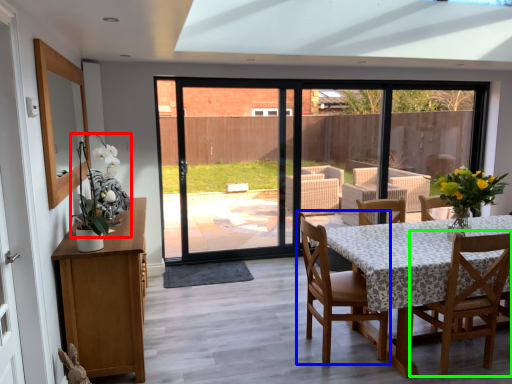
Question: Considering the real-world distances, which object is farthest from floral arrangement (highlighted by a red box)? chair (highlighted by a blue box) or chair (highlighted by a green box)?

Choices:
 (A) chair
 (B) chair

Answer: (B)